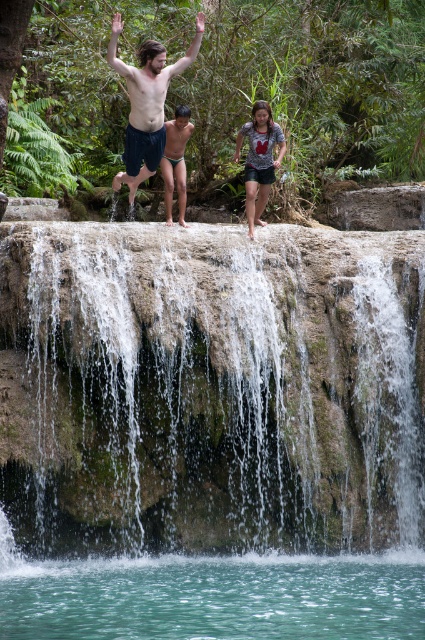
Consider the image. How far apart are clear water at center and matte green swim trunks at center?

clear water at center is 12.14 meters from matte green swim trunks at center.

Between clear water at center and matte green swim trunks at center, which one appears on the right side from the viewer's perspective?

clear water at center

Find the location of a particular element. This screenshot has height=640, width=425. clear water at center is located at coordinates (215, 596).

Does matte black shorts at center come in front of matte blue shorts at center?

No, matte black shorts at center is behind matte blue shorts at center.

Can you confirm if matte black shorts at center is thinner than matte blue shorts at center?

In fact, matte black shorts at center might be wider than matte blue shorts at center.

This screenshot has width=425, height=640. What do you see at coordinates (150, 77) in the screenshot? I see `matte black shorts at center` at bounding box center [150, 77].

What are the coordinates of `matte black shorts at center` in the screenshot? It's located at (150, 77).

Is matte black shorts at center taller than gray printed shirt at center?

Correct, matte black shorts at center is much taller as gray printed shirt at center.

Which is more to the left, matte black shorts at center or gray printed shirt at center?

matte black shorts at center is more to the left.

Is point (118, 70) farther from camera compared to point (246, 156)?

No, (118, 70) is closer to viewer.

At what (x,y) coordinates should I click in order to perform the action: click on matte black shorts at center. Please return your answer as a coordinate pair (x, y). Looking at the image, I should click on (150, 77).